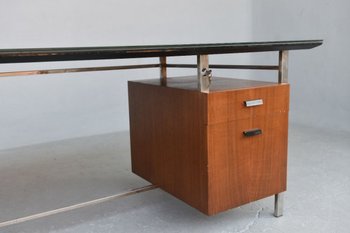
Where is `corner`? corner is located at coordinates (x=251, y=17).